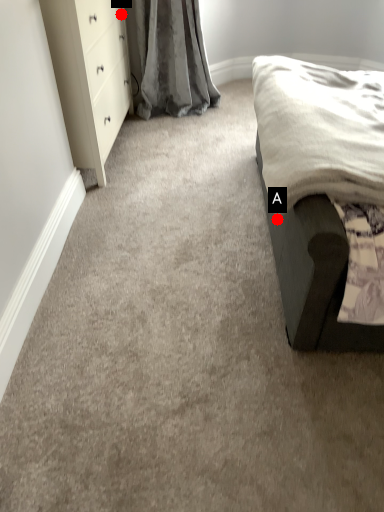
Question: Two points are circled on the image, labeled by A and B beside each circle. Among these points, which one is nearest to the camera?

Choices:
 (A) A is closer
 (B) B is closer

Answer: (A)